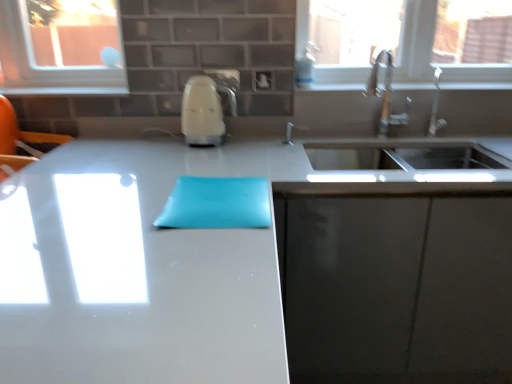
Question: Considering the positions of white glossy window sill at upper center and satin nickel faucet at upper right in the image, is white glossy window sill at upper center bigger or smaller than satin nickel faucet at upper right?

Choices:
 (A) small
 (B) big

Answer: (B)

Question: Visually, is white glossy window sill at upper center positioned to the left or to the right of satin nickel faucet at upper right?

Choices:
 (A) left
 (B) right

Answer: (A)

Question: Based on their relative distances, which object is nearer to the matte gray cabinet at lower right?

Choices:
 (A) white glossy kettle at center
 (B) transparent glass window at upper right
 (C) white glossy countertop at center
 (D) white glossy window sill at upper center
 (E) satin nickel faucet at upper right

Answer: (C)

Question: Which object is the farthest from the transparent glass window at upper right?

Choices:
 (A) white glossy countertop at center
 (B) white glossy window sill at upper center
 (C) white glossy kettle at center
 (D) satin nickel faucet at upper right
 (E) matte gray cabinet at lower right

Answer: (A)